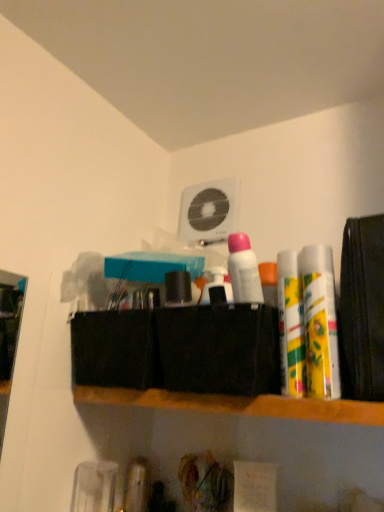
The image size is (384, 512). What do you see at coordinates (209, 211) in the screenshot?
I see `white plastic fan at upper center` at bounding box center [209, 211].

Measure the distance between yellow-green plastic spray cans at right, the 2th toiletry when ordered from right to left, and camera.

A distance of 23.48 inches exists between yellow-green plastic spray cans at right, the 2th toiletry when ordered from right to left, and camera.

Measure the distance between point (x=241, y=400) and camera.

The depth of point (x=241, y=400) is 24.41 inches.

Where is `white plastic fan at upper center`? The height and width of the screenshot is (512, 384). white plastic fan at upper center is located at coordinates click(x=209, y=211).

From the image's perspective, relative to white plastic fan at upper center, is yellow matte lip balm at right, the first toiletry when ordered from right to left, above or below?

Clearly, from the image's perspective, yellow matte lip balm at right, the first toiletry when ordered from right to left, is below white plastic fan at upper center.

This screenshot has height=512, width=384. Find the location of `fan that is above the yellow matte lip balm at right, the first toiletry when ordered from right to left (from the image's perspective)`. fan that is above the yellow matte lip balm at right, the first toiletry when ordered from right to left (from the image's perspective) is located at coordinates (209, 211).

Relative to white plastic fan at upper center, is yellow matte lip balm at right, which appears as the third toiletry when viewed from the left, in front or behind?

Clearly, yellow matte lip balm at right, which appears as the third toiletry when viewed from the left, is in front of white plastic fan at upper center.

Is yellow-green plastic spray cans at right, marked as the second toiletry in a left-to-right arrangement, facing away from wooden shelf at center?

No, yellow-green plastic spray cans at right, marked as the second toiletry in a left-to-right arrangement, is not facing away from wooden shelf at center.

Between yellow-green plastic spray cans at right, marked as the second toiletry in a left-to-right arrangement, and wooden shelf at center, which one has less height?

wooden shelf at center is shorter.

Which object is closer to the camera taking this photo, yellow-green plastic spray cans at right, marked as the second toiletry in a left-to-right arrangement, or wooden shelf at center?

Positioned in front is wooden shelf at center.

Is yellow-green plastic spray cans at right, the 2th toiletry when ordered from right to left, situated inside wooden shelf at center or outside?

yellow-green plastic spray cans at right, the 2th toiletry when ordered from right to left, is outside wooden shelf at center.

Does wooden shelf at center have a greater height compared to yellow-green plastic spray cans at right, the 2th toiletry when ordered from right to left?

No.

Is wooden shelf at center to the left or to the right of yellow-green plastic spray cans at right, marked as the second toiletry in a left-to-right arrangement, in the image?

Clearly, wooden shelf at center is on the left of yellow-green plastic spray cans at right, marked as the second toiletry in a left-to-right arrangement, in the image.

Image resolution: width=384 pixels, height=512 pixels. What are the coordinates of `shelf on the right of white plastic fan at upper center` in the screenshot? It's located at click(238, 405).

Is white plastic fan at upper center oriented towards wooden shelf at center?

No, white plastic fan at upper center is not facing towards wooden shelf at center.

From the image's perspective, which one is positioned lower, white plastic fan at upper center or wooden shelf at center?

wooden shelf at center appears lower in the image.

From a real-world perspective, which is physically above, white matte deodorant at center, placed as the 3th toiletry when sorted from right to left, or yellow-green plastic spray cans at right, the 2th toiletry when ordered from right to left?

white matte deodorant at center, placed as the 3th toiletry when sorted from right to left, is physically above.

In the image, is white matte deodorant at center, placed as the 3th toiletry when sorted from right to left, positioned in front of or behind yellow-green plastic spray cans at right, the 2th toiletry when ordered from right to left?

In the image, white matte deodorant at center, placed as the 3th toiletry when sorted from right to left, appears behind yellow-green plastic spray cans at right, the 2th toiletry when ordered from right to left.

Considering the points (261, 298) and (294, 332), which point is in front, point (261, 298) or point (294, 332)?

The point (294, 332) is closer to the camera.

From the image's perspective, does white matte deodorant at center, placed as the 3th toiletry when sorted from right to left, appear lower than yellow-green plastic spray cans at right, the 2th toiletry when ordered from right to left?

Actually, white matte deodorant at center, placed as the 3th toiletry when sorted from right to left, appears above yellow-green plastic spray cans at right, the 2th toiletry when ordered from right to left, in the image.

Consider the image. Between white plastic fan at upper center and white matte deodorant at center, acting as the first toiletry starting from the left, which one has less height?

white matte deodorant at center, acting as the first toiletry starting from the left, is shorter.

Is white plastic fan at upper center not close to white matte deodorant at center, placed as the 3th toiletry when sorted from right to left?

No.

Is white plastic fan at upper center oriented towards white matte deodorant at center, acting as the first toiletry starting from the left?

No, white plastic fan at upper center is not facing towards white matte deodorant at center, acting as the first toiletry starting from the left.

Is yellow-green plastic spray cans at right, marked as the second toiletry in a left-to-right arrangement, positioned before yellow matte lip balm at right, which appears as the third toiletry when viewed from the left?

No.

Is yellow-green plastic spray cans at right, the 2th toiletry when ordered from right to left, at the left side of yellow matte lip balm at right, which appears as the third toiletry when viewed from the left?

Indeed, yellow-green plastic spray cans at right, the 2th toiletry when ordered from right to left, is positioned on the left side of yellow matte lip balm at right, which appears as the third toiletry when viewed from the left.

Can you confirm if yellow-green plastic spray cans at right, marked as the second toiletry in a left-to-right arrangement, is shorter than yellow matte lip balm at right, which appears as the third toiletry when viewed from the left?

Incorrect, the height of yellow-green plastic spray cans at right, marked as the second toiletry in a left-to-right arrangement, does not fall short of that of yellow matte lip balm at right, which appears as the third toiletry when viewed from the left.

From the image's perspective, between yellow-green plastic spray cans at right, the 2th toiletry when ordered from right to left, and yellow matte lip balm at right, which appears as the third toiletry when viewed from the left, which one is located above?

yellow matte lip balm at right, which appears as the third toiletry when viewed from the left, is shown above in the image.

Where is `the 3rd toiletry to the right of the white plastic fan at upper center, starting your count from the anchor`? the 3rd toiletry to the right of the white plastic fan at upper center, starting your count from the anchor is located at coordinates click(320, 322).

Identify the location of the 2nd toiletry behind the wooden shelf at center, counting from the anchor's position. The height and width of the screenshot is (512, 384). (291, 325).

Estimate the real-world distances between objects in this image. Which object is closer to yellow-green plastic spray cans at right, marked as the second toiletry in a left-to-right arrangement, white plastic fan at upper center or white matte deodorant at center, acting as the first toiletry starting from the left?

The object closer to yellow-green plastic spray cans at right, marked as the second toiletry in a left-to-right arrangement, is white matte deodorant at center, acting as the first toiletry starting from the left.

Looking at the image, which one is located closer to white matte deodorant at center, acting as the first toiletry starting from the left, yellow matte lip balm at right, which appears as the third toiletry when viewed from the left, or wooden shelf at center?

The object closer to white matte deodorant at center, acting as the first toiletry starting from the left, is yellow matte lip balm at right, which appears as the third toiletry when viewed from the left.

Estimate the real-world distances between objects in this image. Which object is closer to yellow matte lip balm at right, which appears as the third toiletry when viewed from the left, white plastic fan at upper center or yellow-green plastic spray cans at right, marked as the second toiletry in a left-to-right arrangement?

yellow-green plastic spray cans at right, marked as the second toiletry in a left-to-right arrangement.

Based on their spatial positions, is white matte deodorant at center, placed as the 3th toiletry when sorted from right to left, or wooden shelf at center closer to yellow-green plastic spray cans at right, marked as the second toiletry in a left-to-right arrangement?

white matte deodorant at center, placed as the 3th toiletry when sorted from right to left.

Looking at the image, which one is located further to yellow-green plastic spray cans at right, the 2th toiletry when ordered from right to left, yellow matte lip balm at right, the first toiletry when ordered from right to left, or white matte deodorant at center, acting as the first toiletry starting from the left?

Based on the image, white matte deodorant at center, acting as the first toiletry starting from the left, appears to be further to yellow-green plastic spray cans at right, the 2th toiletry when ordered from right to left.

From the image, which object appears to be farther from white plastic fan at upper center, yellow matte lip balm at right, which appears as the third toiletry when viewed from the left, or white matte deodorant at center, placed as the 3th toiletry when sorted from right to left?

Among the two, yellow matte lip balm at right, which appears as the third toiletry when viewed from the left, is located further to white plastic fan at upper center.

Estimate the real-world distances between objects in this image. Which object is further from wooden shelf at center, yellow matte lip balm at right, which appears as the third toiletry when viewed from the left, or white matte deodorant at center, placed as the 3th toiletry when sorted from right to left?

Among the two, white matte deodorant at center, placed as the 3th toiletry when sorted from right to left, is located further to wooden shelf at center.

Considering their positions, is yellow matte lip balm at right, the first toiletry when ordered from right to left, positioned closer to yellow-green plastic spray cans at right, marked as the second toiletry in a left-to-right arrangement, than wooden shelf at center?

yellow matte lip balm at right, the first toiletry when ordered from right to left, is closer to yellow-green plastic spray cans at right, marked as the second toiletry in a left-to-right arrangement.

Where is `toiletry between yellow-green plastic spray cans at right, marked as the second toiletry in a left-to-right arrangement, and white plastic fan at upper center, along the z-axis`? The height and width of the screenshot is (512, 384). toiletry between yellow-green plastic spray cans at right, marked as the second toiletry in a left-to-right arrangement, and white plastic fan at upper center, along the z-axis is located at coordinates (244, 270).

Find the location of a particular element. The height and width of the screenshot is (512, 384). toiletry between yellow matte lip balm at right, which appears as the third toiletry when viewed from the left, and wooden shelf at center in the up-down direction is located at coordinates (291, 325).

Where is `toiletry between white matte deodorant at center, placed as the 3th toiletry when sorted from right to left, and yellow matte lip balm at right, the first toiletry when ordered from right to left, from left to right`? The width and height of the screenshot is (384, 512). toiletry between white matte deodorant at center, placed as the 3th toiletry when sorted from right to left, and yellow matte lip balm at right, the first toiletry when ordered from right to left, from left to right is located at coordinates (291, 325).